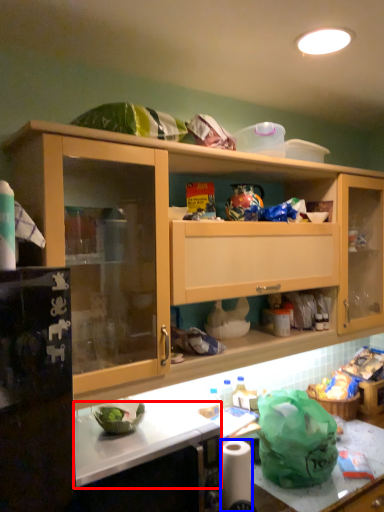
Question: Which object appears farthest to the camera in this image, counter top (highlighted by a red box) or toilet paper (highlighted by a blue box)?

Choices:
 (A) counter top
 (B) toilet paper

Answer: (B)